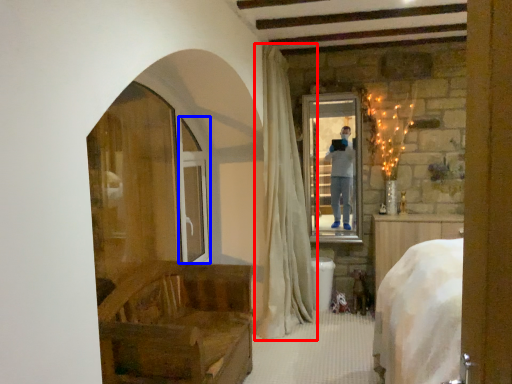
Question: Which point is closer to the camera, curtain (highlighted by a red box) or screen door (highlighted by a blue box)?

Choices:
 (A) curtain
 (B) screen door

Answer: (A)